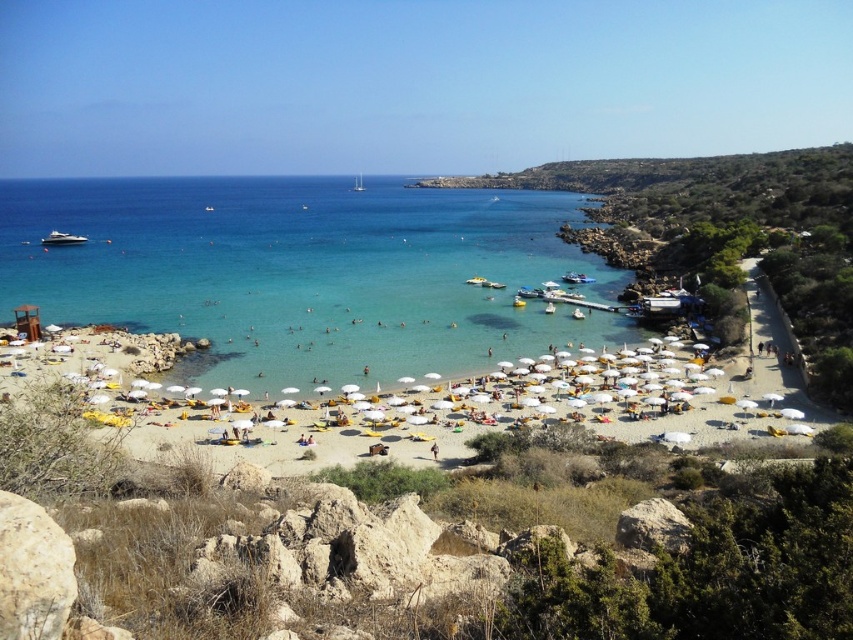
Is clear blue water at center below white plastic boat at center?

Correct, clear blue water at center is located below white plastic boat at center.

Consider the image. Does clear blue water at center have a larger size compared to white plastic boat at center?

Yes.

Who is more forward, (421, 356) or (363, 188)?

Point (421, 356) is in front.

What are the coordinates of `clear blue water at center` in the screenshot? It's located at (305, 273).

Between white sand at center and white glossy boat at left, which one has more height?

With more height is white sand at center.

Is point (175, 428) closer to camera compared to point (55, 234)?

Yes.

Is point (57, 337) behind point (70, 244)?

No, (57, 337) is closer to viewer.

Find the location of a particular element. The width and height of the screenshot is (853, 640). white sand at center is located at coordinates (543, 419).

Between clear blue water at center and white sand at center, which one is positioned higher?

clear blue water at center is above.

Can you confirm if clear blue water at center is thinner than white sand at center?

No, clear blue water at center is not thinner than white sand at center.

The height and width of the screenshot is (640, 853). What are the coordinates of `clear blue water at center` in the screenshot? It's located at tap(305, 273).